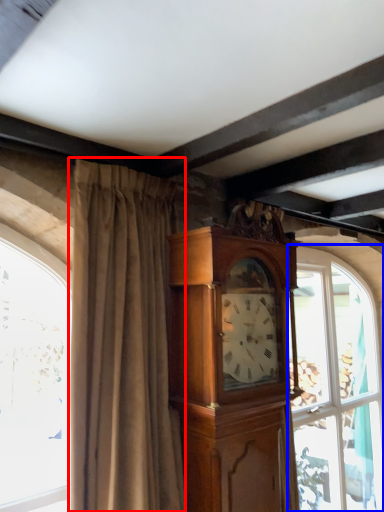
Question: Which point is closer to the camera, curtain (highlighted by a red box) or window (highlighted by a blue box)?

Choices:
 (A) curtain
 (B) window

Answer: (A)